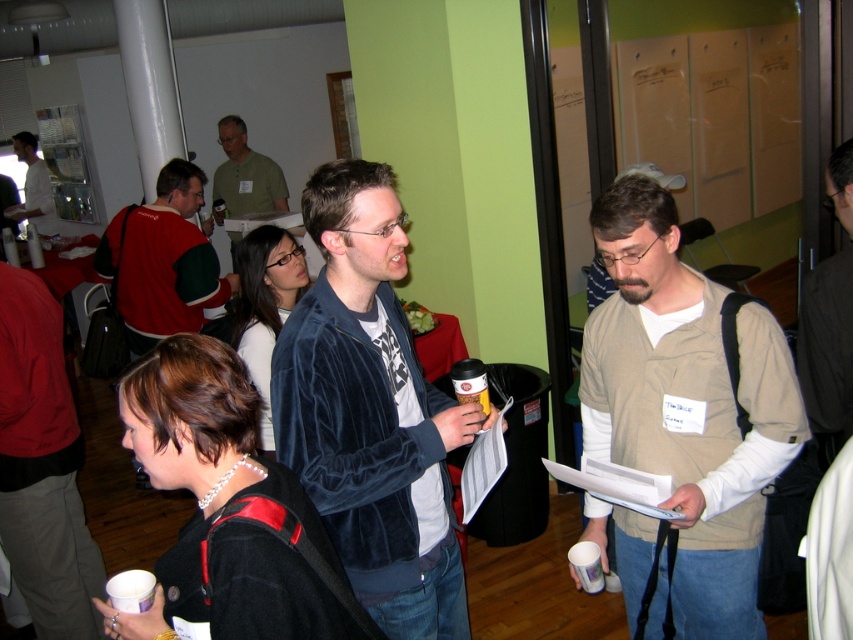
You are organizing a photo shoot and need to place a model exactly at the center of the image. However, there is a velvet jacket at center. Can you place the model at the exact center without overlapping the jacket?

The velvet jacket at center is already positioned at the center of the image at point (163,260), so placing the model exactly at the center would overlap with the jacket.